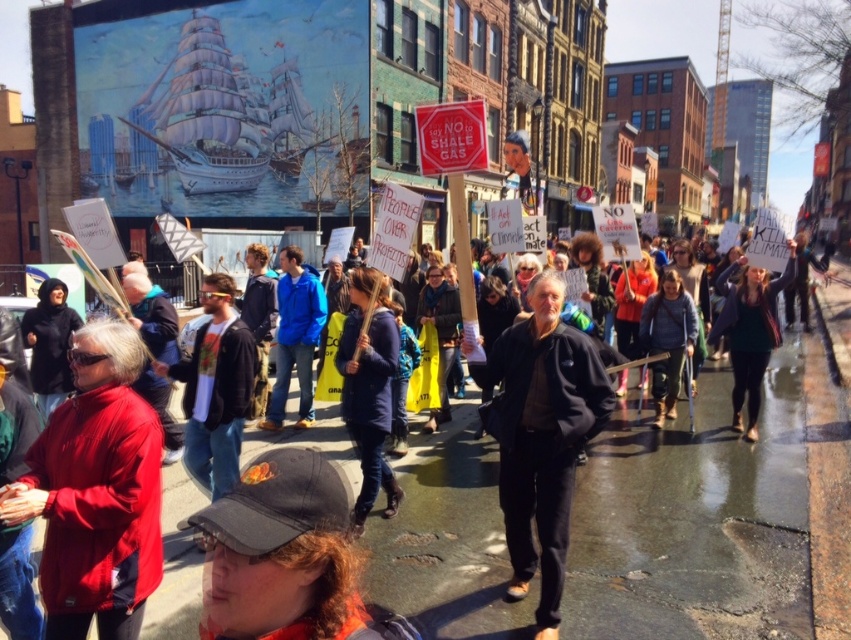
You are standing at the protest and want to take a photo of the point at coordinates [140,552]. If your camera can focus on objects within 3 meters, will it be able to capture that point clearly?

The distance of point [140,552] from the viewer is 3.18 meters, which is slightly beyond the camera focus range of 3 meters. Therefore, the camera may not capture the point clearly.

You are a photographer standing at the edge of the protest crowd. You want to take a photo of the red softshell jacket at lower left and ensure the large mural with the ship in the background is also visible. Can you position yourself so both are in frame without moving either object?

The red softshell jacket at lower left and the large mural with the ship in the background are 2.80 meters apart. Since the photographer can adjust their position to capture both within the camera frame, yes, it is possible to position yourself so both are in frame without moving either object.